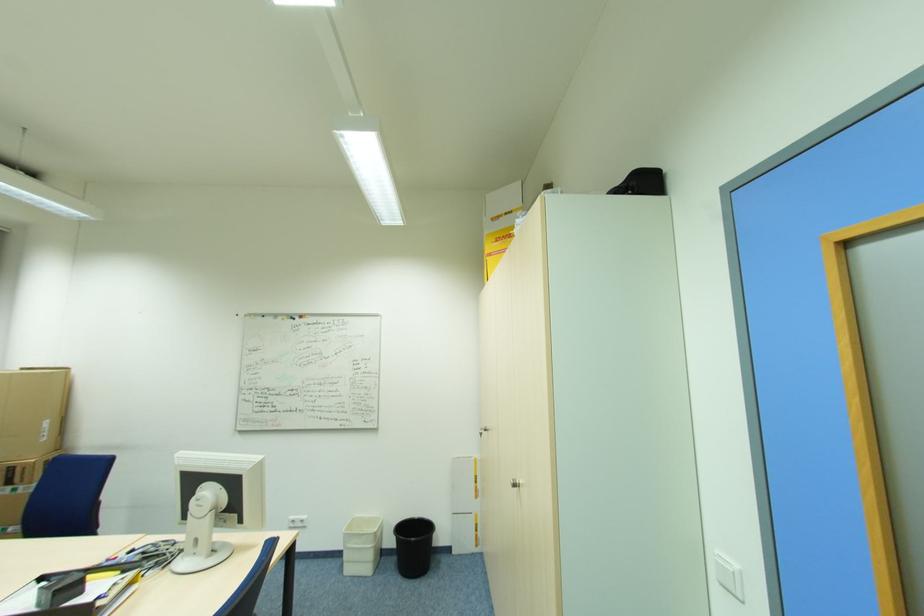
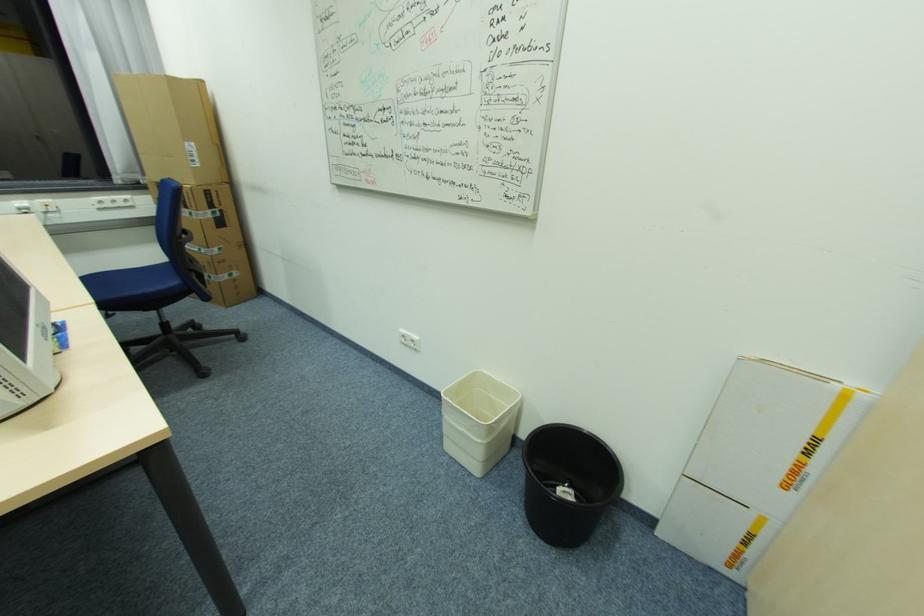
The point at (479, 491) is marked in the first image. Where is the corresponding point in the second image?

(797, 472)